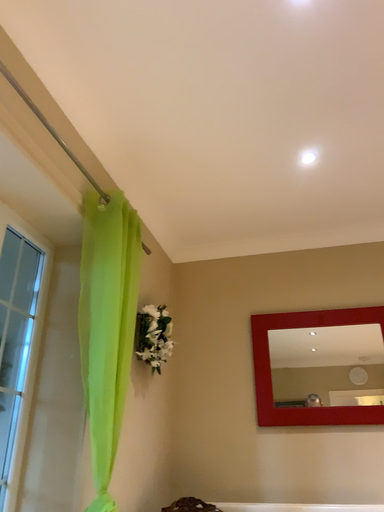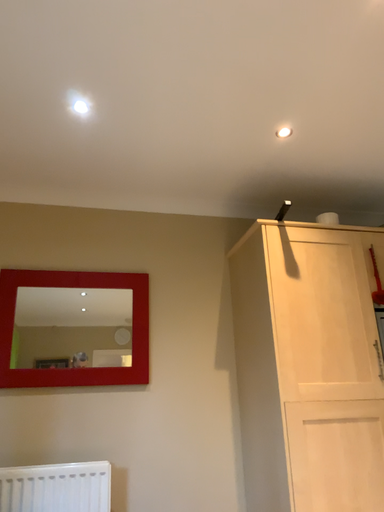
Question: How did the camera likely rotate when shooting the video?

Choices:
 (A) rotated upward
 (B) rotated downward

Answer: (B)